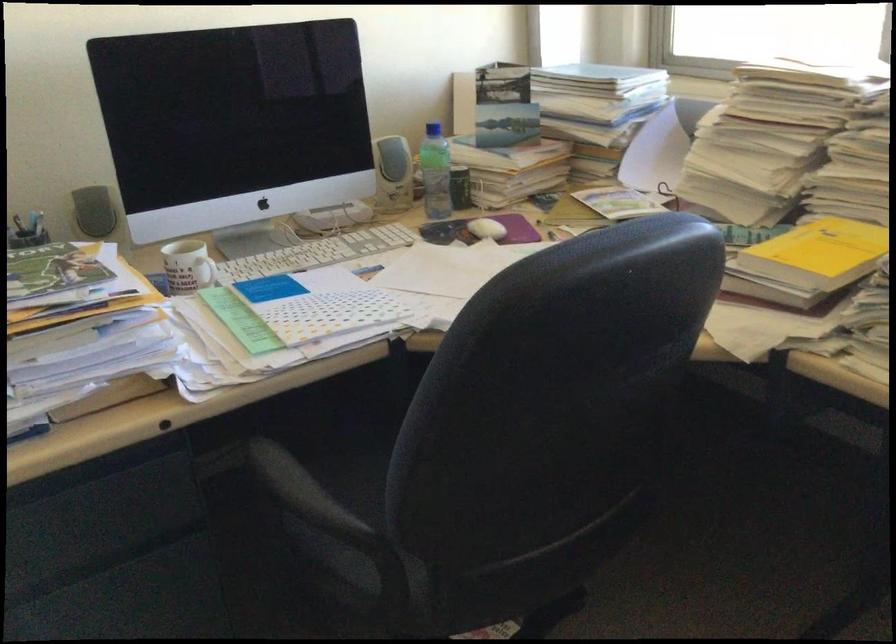
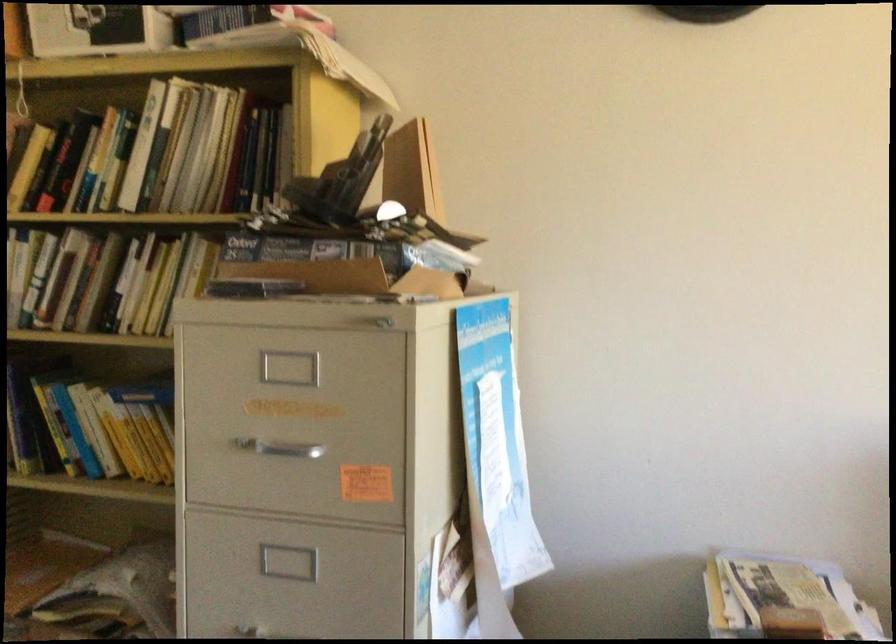
Question: How did the camera likely rotate?

Choices:
 (A) Left
 (B) Right
 (C) Up
 (D) Down

Answer: (A)